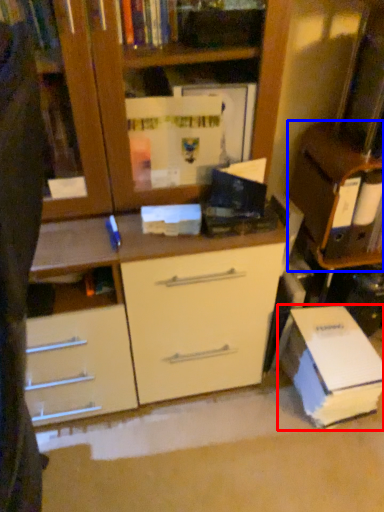
Question: Which object appears farthest to the camera in this image, paperback book (highlighted by a red box) or cabinetry (highlighted by a blue box)?

Choices:
 (A) paperback book
 (B) cabinetry

Answer: (A)